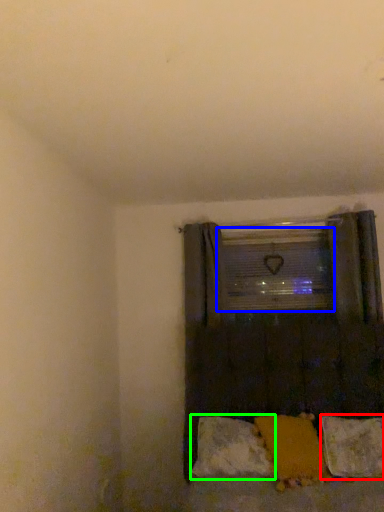
Question: Estimate the real-world distances between objects in this image. Which object is closer to pillow (highlighted by a red box), window screen (highlighted by a blue box) or pillow (highlighted by a green box)?

Choices:
 (A) window screen
 (B) pillow

Answer: (B)